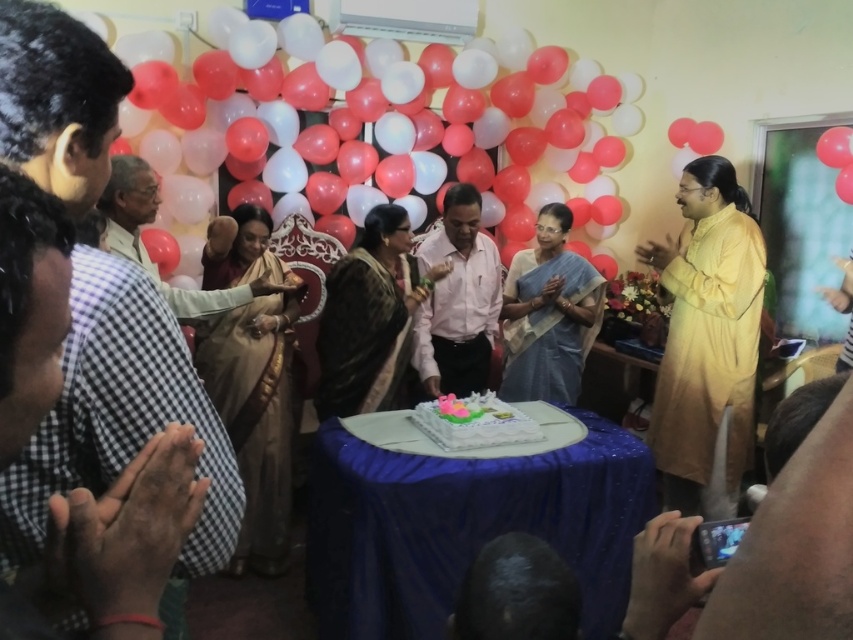
You are a photographer at the birthday party. You need to capture a photo that includes both the light brown fabric saree at center and the white frosted cake at center. Which object should you focus on first to ensure both are in frame?

The light brown fabric saree at center is bigger than the white frosted cake at center, so you should focus on the light brown fabric saree at center first to ensure both are in frame.

You are a photographer at the birthday party and want to capture a photo of both the light brown fabric saree at center and the white frosted cake at center. Which object should you focus on first to ensure both are in sharp focus?

You should focus on the light brown fabric saree at center first because it is closer to the viewer than the white frosted cake at center. By focusing on the closer object, the background object may still be in acceptable focus depending on the lens and aperture used, maximizing the chances of both being sharp.